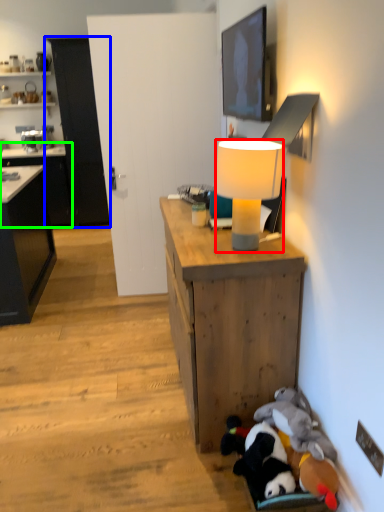
Question: Which object is the closest to the lamp (highlighted by a red box)? Choose among these: cabinetry (highlighted by a blue box) or cabinetry (highlighted by a green box).

Choices:
 (A) cabinetry
 (B) cabinetry

Answer: (B)